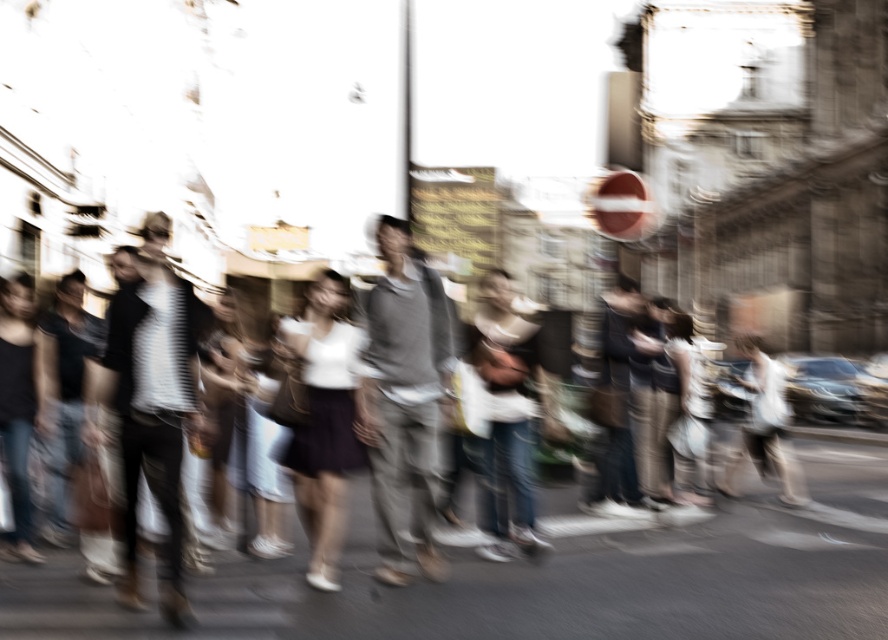
Question: Among these points, which one is farthest from the camera?

Choices:
 (A) (218, 582)
 (B) (424, 344)

Answer: (B)

Question: Which point is closer to the camera?

Choices:
 (A) (387, 269)
 (B) (666, 592)

Answer: (B)

Question: In this image, where is matte gray pants at center located relative to gray fabric skateboard at center?

Choices:
 (A) left
 (B) right

Answer: (B)

Question: Is matte gray pants at center above gray fabric skateboard at center?

Choices:
 (A) no
 (B) yes

Answer: (A)

Question: Can you confirm if matte gray pants at center is positioned to the right of gray fabric skateboard at center?

Choices:
 (A) no
 (B) yes

Answer: (B)